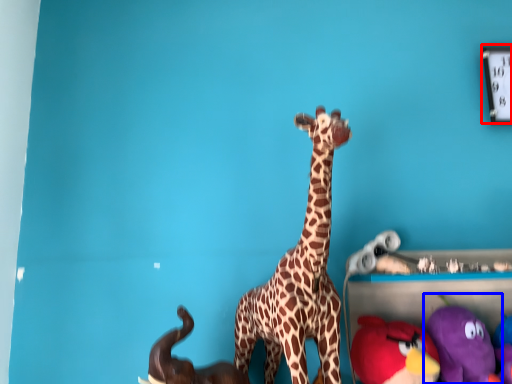
Question: Which of the following is the closest to the observer, clock (highlighted by a red box) or toy (highlighted by a blue box)?

Choices:
 (A) clock
 (B) toy

Answer: (B)